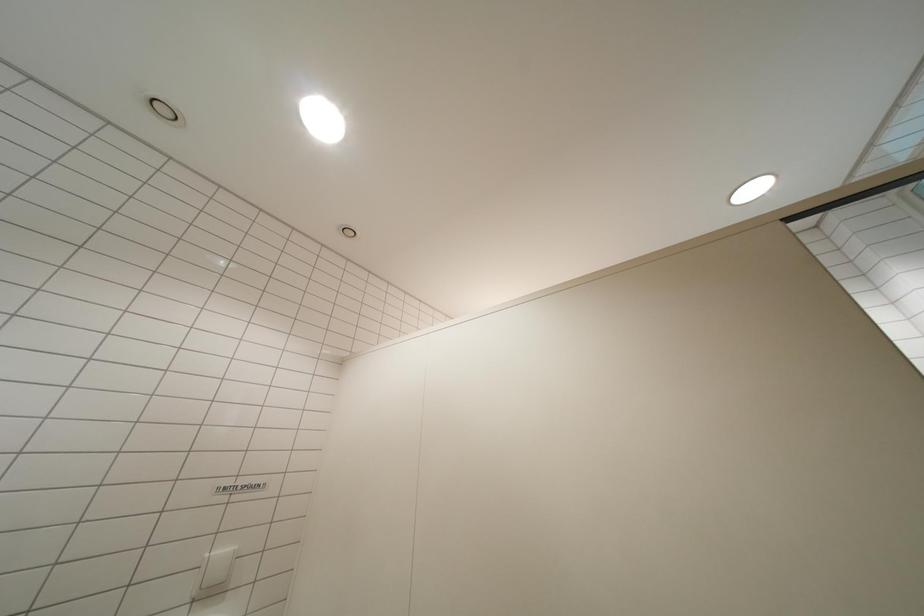
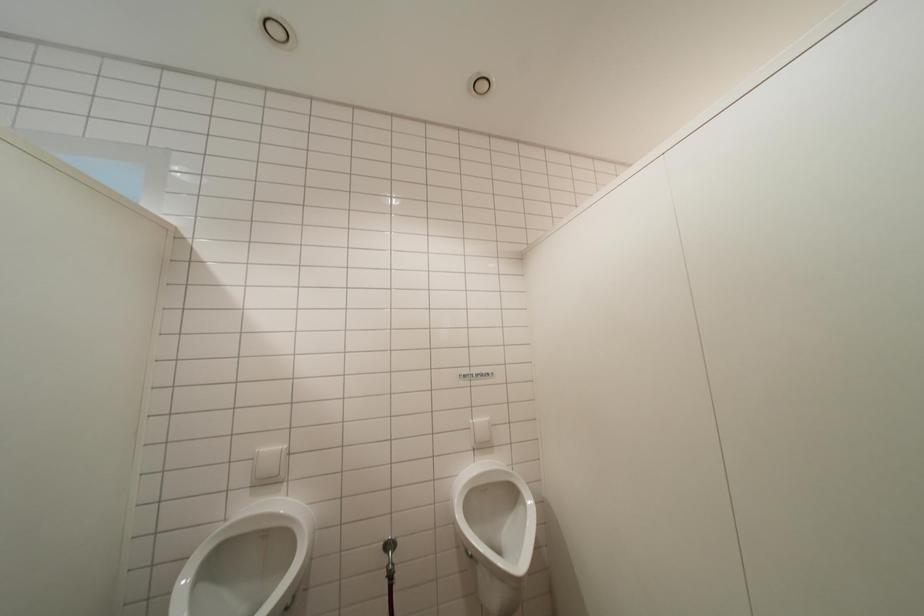
Question: The camera is either moving clockwise (left) or counter-clockwise (right) around the object. The first image is from the beginning of the video and the second image is from the end. Is the camera moving left or right when shooting the video?

Choices:
 (A) Left
 (B) Right

Answer: (B)